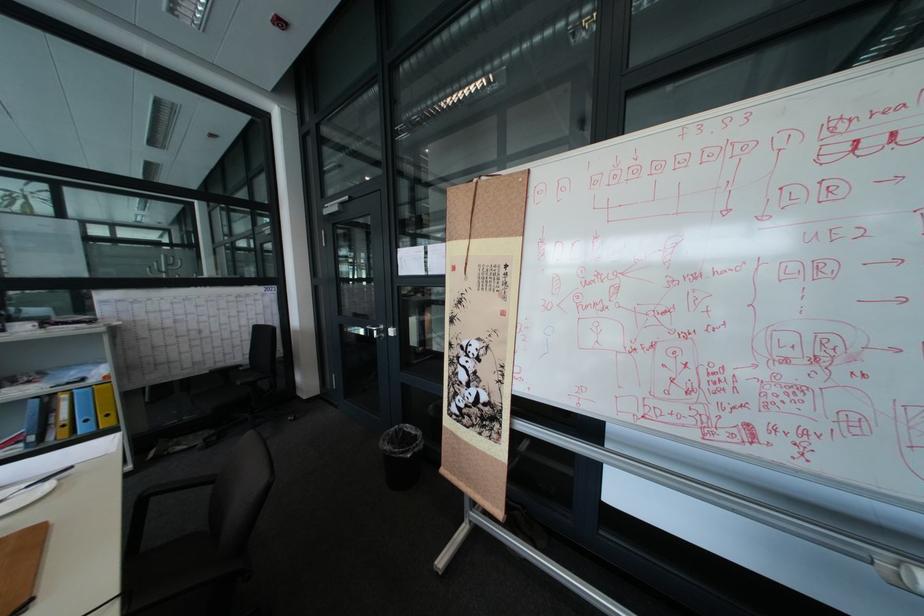
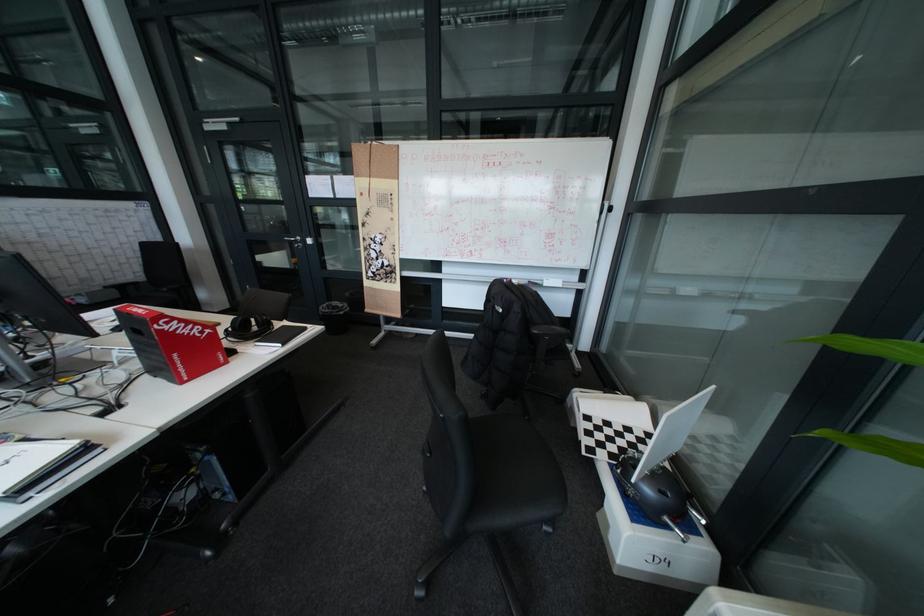
Locate, in the second image, the point that corresponds to point 382,328 in the first image.

(299, 238)